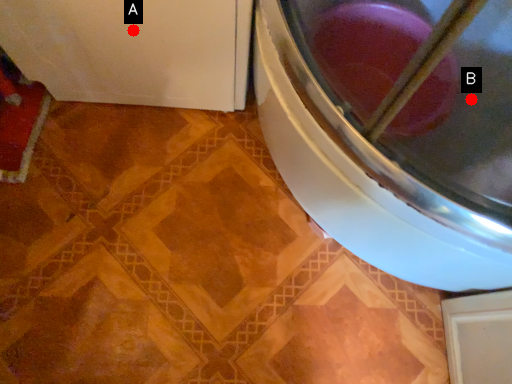
Question: Two points are circled on the image, labeled by A and B beside each circle. Which of the following is the farthest from the observer?

Choices:
 (A) A is further
 (B) B is further

Answer: (B)